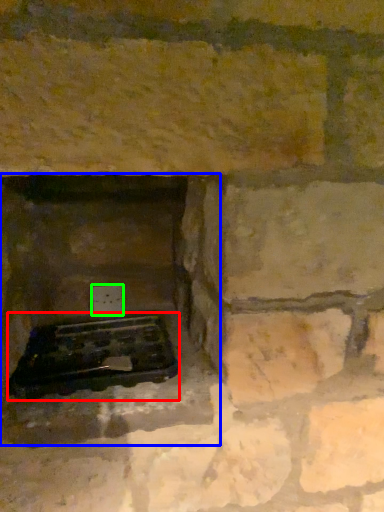
Question: Which is nearer to the grill (highlighted by a red box)? fireplace (highlighted by a blue box) or electric outlet (highlighted by a green box).

Choices:
 (A) fireplace
 (B) electric outlet

Answer: (A)